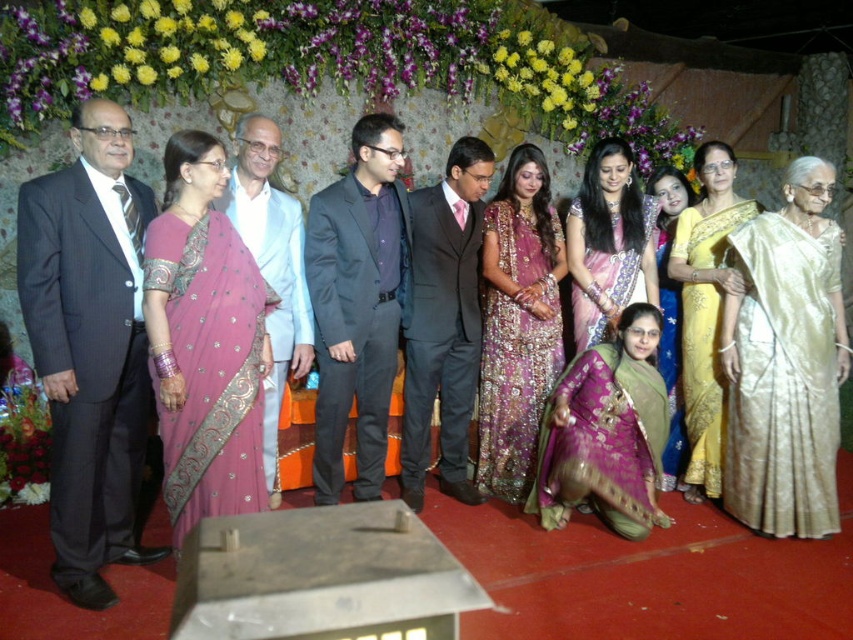
You are a photographer positioned at the back of the room. You need to take a photo that includes both the dark gray pinstripe suit at left and the dark gray suit at center. Which suit will appear larger in the photo?

The dark gray pinstripe suit at left will appear larger in the photo because it is closer to the photographer than the dark gray suit at center.

You are a photographer at the event and want to capture a clear photo of the dark gray suit at center without the gold silk saree at center blocking it. What should you do?

Move to a position where the dark gray suit at center is no longer behind the gold silk saree at center, allowing you to capture it clearly.